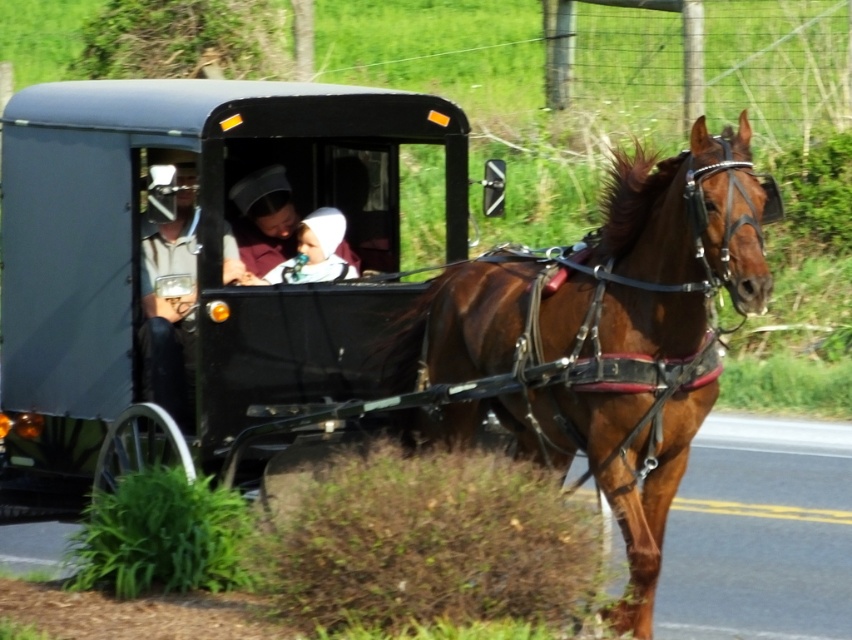
Can you confirm if light brown leather jacket at center is taller than matte brown dress at center?

Correct, light brown leather jacket at center is much taller as matte brown dress at center.

Is light brown leather jacket at center below matte brown dress at center?

Yes, light brown leather jacket at center is below matte brown dress at center.

Does point (188, 248) come farther from viewer compared to point (269, 227)?

No.

Identify the location of light brown leather jacket at center. tap(170, 305).

Is point (426, 332) farther from viewer compared to point (309, 280)?

No, it is in front of (309, 280).

Can you confirm if brown glossy harness at center is taller than matte brown dress at center?

Yes, brown glossy harness at center is taller than matte brown dress at center.

Which is in front, point (622, 531) or point (275, 236)?

Point (622, 531) is in front.

At what (x,y) coordinates should I click in order to perform the action: click on brown glossy harness at center. Please return your answer as a coordinate pair (x, y). Image resolution: width=852 pixels, height=640 pixels. Looking at the image, I should click on (603, 339).

Is light brown leather jacket at center above white cloth at center?

No, light brown leather jacket at center is not above white cloth at center.

Does light brown leather jacket at center lie in front of white cloth at center?

Yes.

Locate an element on the screen. The height and width of the screenshot is (640, 852). light brown leather jacket at center is located at coordinates (x=170, y=305).